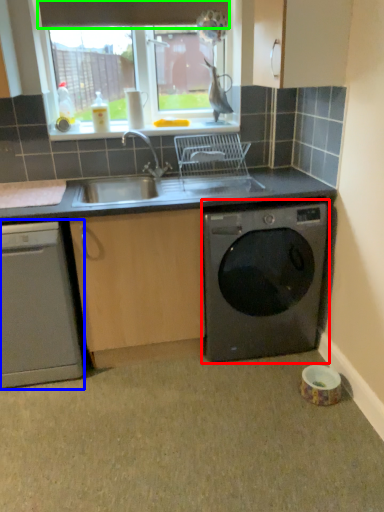
Question: Based on their relative distances, which object is farther from washing machine (highlighted by a red box)? Choose from dishwasher (highlighted by a blue box) and exhaust hood (highlighted by a green box).

Choices:
 (A) dishwasher
 (B) exhaust hood

Answer: (B)